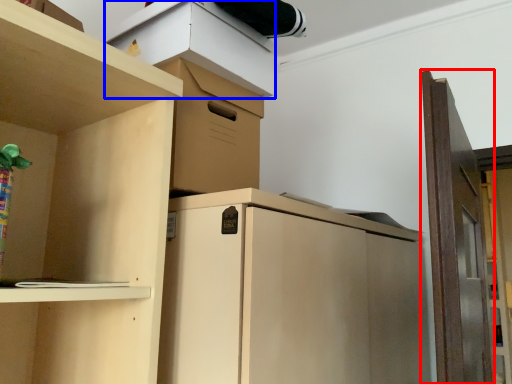
Question: Which object appears closest to the camera in this image, door (highlighted by a red box) or cabinet (highlighted by a blue box)?

Choices:
 (A) door
 (B) cabinet

Answer: (A)